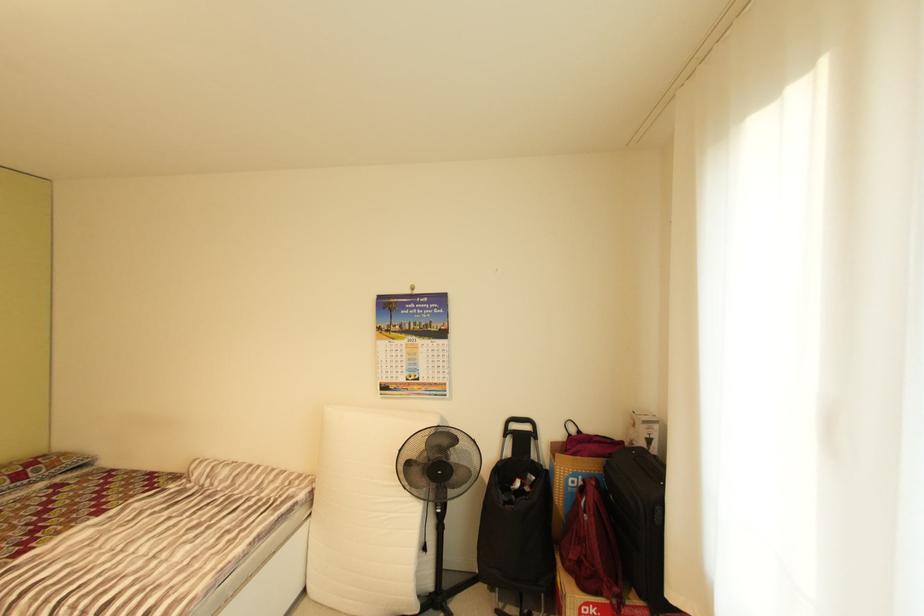
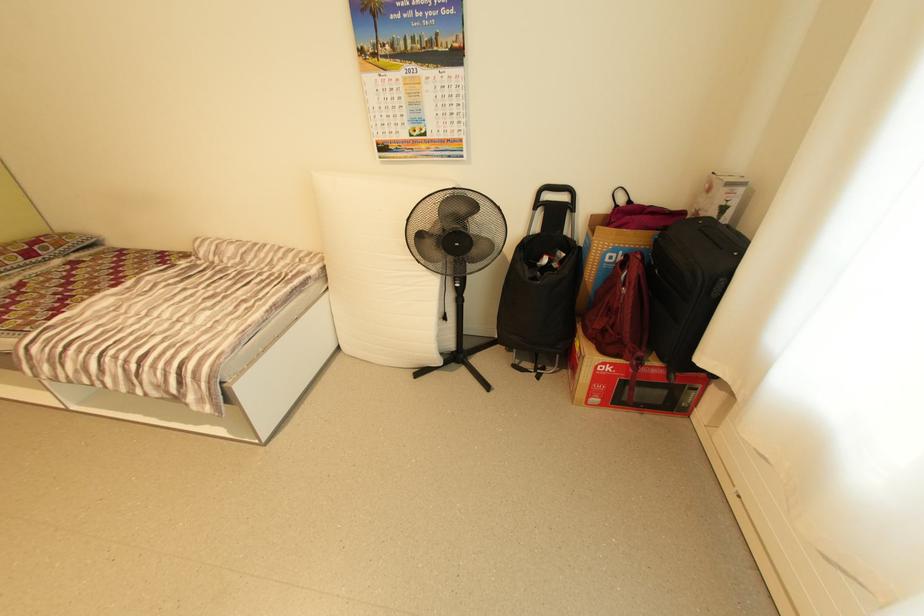
In the second image, find the point that corresponds to point (445, 512) in the first image.

(464, 286)